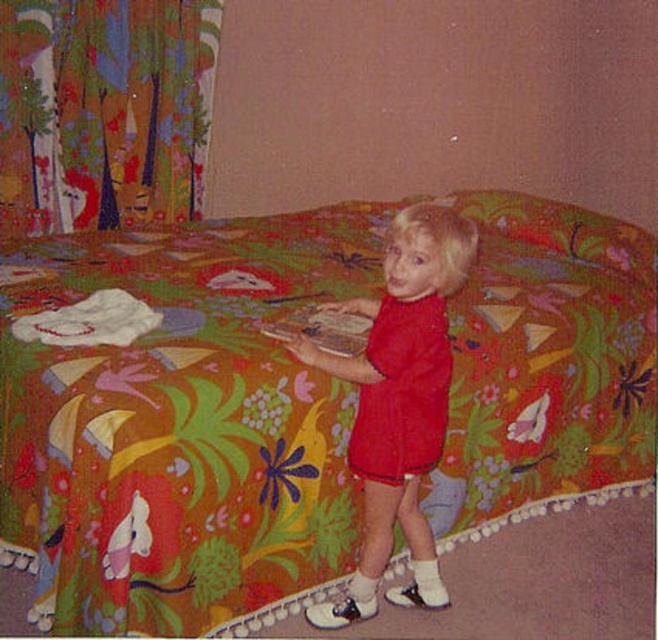
You are a photographer setting up a shot of the floral fabric bed at center and the multicolored fabric curtain at upper left. Which object should you focus on first if you want to capture both in sharp focus?

The floral fabric bed at center is closer to the viewer than the multicolored fabric curtain at upper left, so you should focus on the floral fabric bed at center first to ensure both are in sharp focus.

Based on the scene description, where is the floral fabric bed at center in relation to the multicolored fabric curtain at upper left?

The floral fabric bed at center is to the right of the multicolored fabric curtain at upper left.

Consider the image. You are a tailor trying to decide if the matte red dress at center can fit on the floral fabric bed at center without overlapping the edges. Based on their widths, can the dress be placed centrally on the bed?

The floral fabric bed at center is wider than the matte red dress at center, so the dress can be placed centrally on the bed without overlapping the edges.